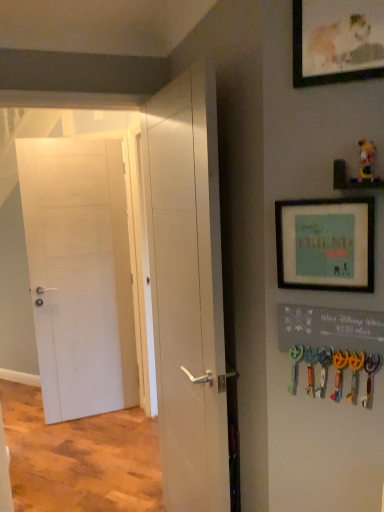
Question: Is white matte door at left, the first door in the left-to-right sequence, located within white matte door at center, which is the second door in left-to-right order?

Choices:
 (A) yes
 (B) no

Answer: (B)

Question: From the image's perspective, does white matte door at center, placed as the 2th door when sorted from back to front, appear lower than white matte door at left, which is counted as the first door, starting from the back?

Choices:
 (A) no
 (B) yes

Answer: (B)

Question: From a real-world perspective, is white matte door at center, which is the 1th door in front-to-back order, located beneath white matte door at left, the 2th door viewed from the right?

Choices:
 (A) no
 (B) yes

Answer: (A)

Question: Is white matte door at center, arranged as the first door when viewed from the right, facing away from white matte door at left, the first door in the left-to-right sequence?

Choices:
 (A) no
 (B) yes

Answer: (A)

Question: Would you say white matte door at center, which is the second door in left-to-right order, is a long distance from white matte door at left, which is counted as the second door, starting from the front?

Choices:
 (A) no
 (B) yes

Answer: (B)

Question: Is white matte door at left, which is counted as the second door, starting from the front, spatially inside matte wooden picture frame at upper right, positioned as the second picture frame in bottom-to-top order, or outside of it?

Choices:
 (A) inside
 (B) outside

Answer: (B)

Question: Is white matte door at left, which is counted as the second door, starting from the front, bigger or smaller than matte wooden picture frame at upper right, which is the 1th picture frame from top to bottom?

Choices:
 (A) big
 (B) small

Answer: (A)

Question: From the image's perspective, relative to matte wooden picture frame at upper right, which is the 1th picture frame from top to bottom, is white matte door at left, which is counted as the first door, starting from the back, above or below?

Choices:
 (A) below
 (B) above

Answer: (A)

Question: In terms of height, does white matte door at left, the first door in the left-to-right sequence, look taller or shorter compared to matte wooden picture frame at upper right, which is the 1th picture frame from top to bottom?

Choices:
 (A) short
 (B) tall

Answer: (B)

Question: Considering the relative positions of white matte door at center, which is the second door in left-to-right order, and plush yellow bear at upper right in the image provided, is white matte door at center, which is the second door in left-to-right order, to the left or to the right of plush yellow bear at upper right?

Choices:
 (A) left
 (B) right

Answer: (A)

Question: From a real-world perspective, is white matte door at center, placed as the 2th door when sorted from back to front, physically located above or below plush yellow bear at upper right?

Choices:
 (A) below
 (B) above

Answer: (A)

Question: From the image's perspective, relative to plush yellow bear at upper right, is white matte door at center, which is the 1th door in front-to-back order, above or below?

Choices:
 (A) above
 (B) below

Answer: (B)

Question: Looking at the image, does white matte door at center, placed as the 2th door when sorted from back to front, seem bigger or smaller compared to plush yellow bear at upper right?

Choices:
 (A) small
 (B) big

Answer: (B)

Question: Relative to teal matte picture frame at upper right, which appears as the second picture frame when viewed from the top, is white matte door at left, the 2th door viewed from the right, in front or behind?

Choices:
 (A) behind
 (B) front

Answer: (A)

Question: From the image's perspective, is white matte door at left, the 2th door viewed from the right, positioned above or below teal matte picture frame at upper right, which appears as the second picture frame when viewed from the top?

Choices:
 (A) below
 (B) above

Answer: (A)